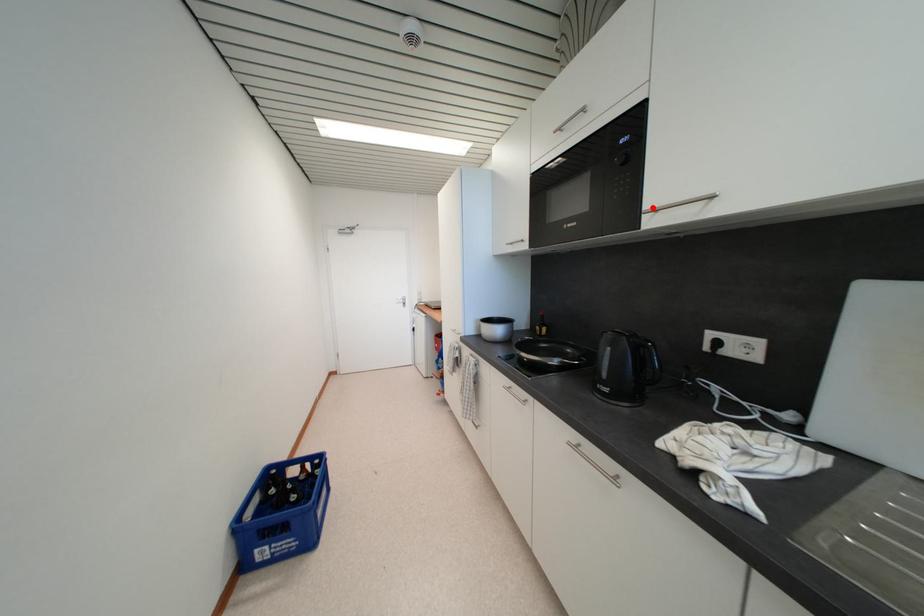
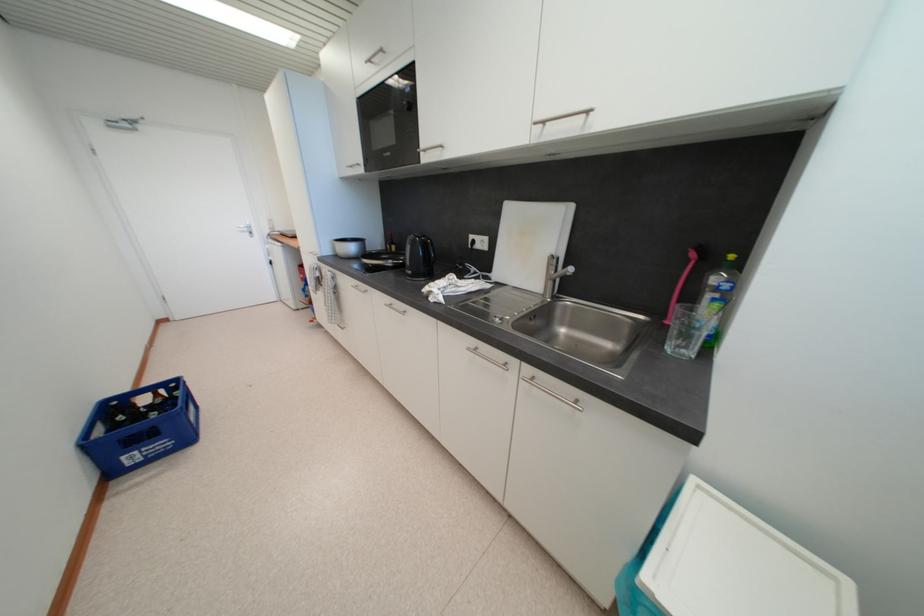
In the second image, find the point that corresponds to the highlighted location in the first image.

(428, 148)